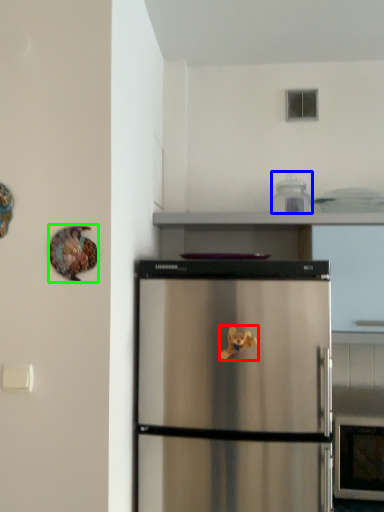
Question: Estimate the real-world distances between objects in this image. Which object is closer to toy (highlighted by a red box), appliance (highlighted by a blue box) or animal (highlighted by a green box)?

Choices:
 (A) appliance
 (B) animal

Answer: (B)